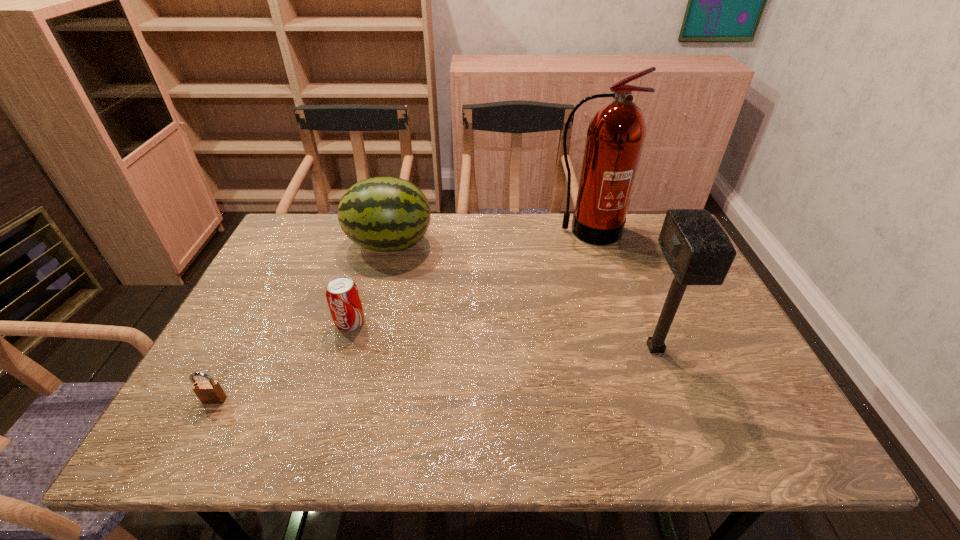
This screenshot has height=540, width=960. What are the coordinates of `fire extinguisher` in the screenshot? It's located at (616, 134).

Image resolution: width=960 pixels, height=540 pixels. I want to click on mallet, so click(x=698, y=251).

Locate an element on the screen. Image resolution: width=960 pixels, height=540 pixels. the third shortest object is located at coordinates (385, 213).

The image size is (960, 540). In order to click on the second shortest object in this screenshot , I will do `click(342, 294)`.

Where is `the shortest object`? This screenshot has height=540, width=960. the shortest object is located at coordinates (209, 392).

The height and width of the screenshot is (540, 960). I want to click on the leftmost object, so click(209, 392).

Find the location of a particular element. free space located on the front-facing side of the fire extinguisher is located at coordinates (601, 276).

At what (x,y) coordinates should I click in order to perform the action: click on free space located 0.110m on the right of the mallet. Please return your answer as a coordinate pair (x, y). The width and height of the screenshot is (960, 540). Looking at the image, I should click on (719, 348).

Where is `vacant space positioned 0.330m at the stem end of the watermelon`? vacant space positioned 0.330m at the stem end of the watermelon is located at coordinates (540, 244).

Identify the location of vacant area situated 0.230m on the right of the fourth tallest object. Image resolution: width=960 pixels, height=540 pixels. (456, 322).